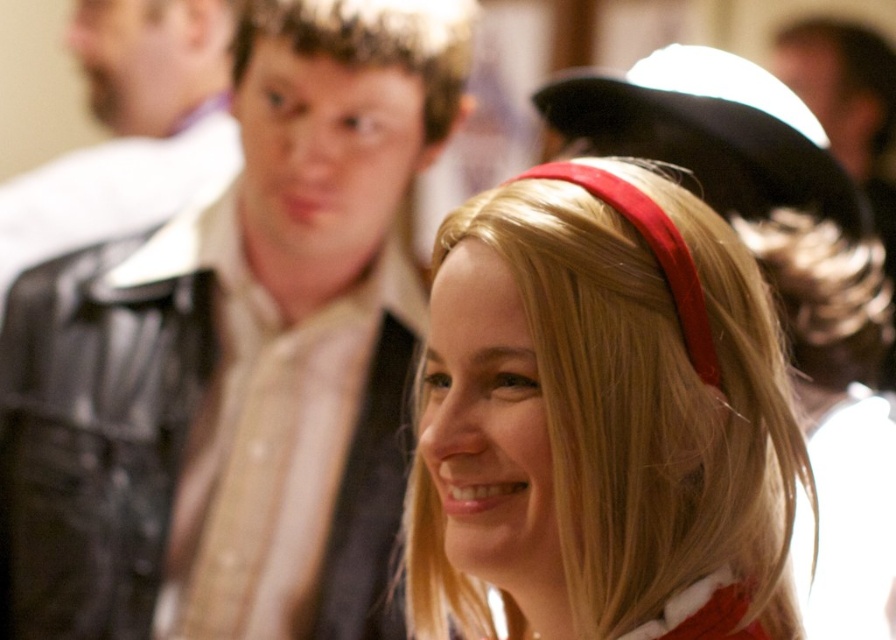
When you look at the image, there is a point at coordinates (238, 358). What object in the scene is located at this point?

The point at coordinates (238, 358) corresponds to the leather jacket at upper left.

You are standing at the camera position and want to reach the point marked at coordinate point (x=711, y=618). If your walking distance is limited to 30 inches, can you reach it?

The point marked at coordinate point (x=711, y=618) is 28.28 inches away from the camera, so yes, you can reach it within the 30 inch limit.

You are standing at the point with coordinates point (36, 224) and want to move towards the point with coordinates point (446, 320). Will you pass through the area where the woman in the foreground is standing?

Yes, you will pass through the area where the woman in the foreground is standing because point (446, 320) is in front of point (36, 224), meaning the path between them goes through the woman.